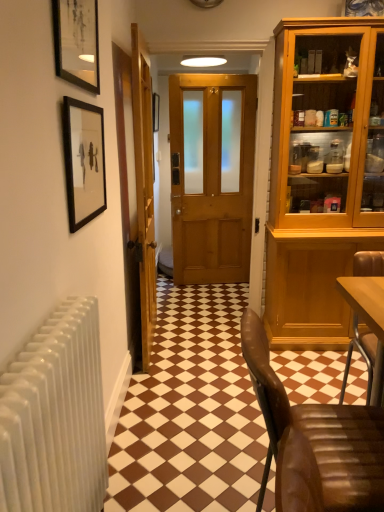
Question: From a real-world perspective, is brown leather chair at lower right physically above wooden door at center, the 1th door from the right?

Choices:
 (A) yes
 (B) no

Answer: (B)

Question: Does brown leather chair at lower right turn towards wooden door at center, positioned as the 2th door in left-to-right order?

Choices:
 (A) no
 (B) yes

Answer: (A)

Question: Is brown leather chair at lower right positioned beyond the bounds of wooden door at center, the 1th door from the right?

Choices:
 (A) no
 (B) yes

Answer: (B)

Question: From the image's perspective, is brown leather chair at lower right beneath wooden door at center, the 1th door from the right?

Choices:
 (A) yes
 (B) no

Answer: (A)

Question: Can you confirm if brown leather chair at lower right is wider than wooden door at center, the 1th door from the right?

Choices:
 (A) yes
 (B) no

Answer: (A)

Question: Is matte black picture frame at upper left, which is the 1th picture frame in front-to-back order, spatially inside wooden door at center, positioned as the 2th door in left-to-right order, or outside of it?

Choices:
 (A) inside
 (B) outside

Answer: (B)

Question: Would you say matte black picture frame at upper left, which is counted as the second picture frame, starting from the bottom, is to the left or to the right of wooden door at center, positioned as the 2th door in left-to-right order, in the picture?

Choices:
 (A) right
 (B) left

Answer: (B)

Question: Considering the positions of point (76, 44) and point (185, 84), is point (76, 44) closer or farther from the camera than point (185, 84)?

Choices:
 (A) closer
 (B) farther

Answer: (A)

Question: Relative to wooden door at center, positioned as the 2th door in left-to-right order, is matte black picture frame at upper left, which is the 1th picture frame in front-to-back order, in front or behind?

Choices:
 (A) behind
 (B) front

Answer: (B)

Question: Does point (319, 500) appear closer or farther from the camera than point (243, 166)?

Choices:
 (A) closer
 (B) farther

Answer: (A)

Question: From the image's perspective, is brown leather chair at lower right positioned above or below wooden door at center, positioned as the 2th door in left-to-right order?

Choices:
 (A) below
 (B) above

Answer: (A)

Question: Considering the positions of brown leather chair at lower right and wooden door at center, the 1th door from the right, in the image, is brown leather chair at lower right wider or thinner than wooden door at center, the 1th door from the right,?

Choices:
 (A) wide
 (B) thin

Answer: (A)

Question: Visually, is brown leather chair at lower right positioned to the left or to the right of wooden door at center, positioned as the 2th door in left-to-right order?

Choices:
 (A) right
 (B) left

Answer: (A)

Question: Does point (76, 5) appear closer or farther from the camera than point (139, 111)?

Choices:
 (A) farther
 (B) closer

Answer: (B)

Question: Would you say matte black picture frame at upper left, arranged as the third picture frame when viewed from the back, is inside or outside wooden door at center, marked as the 2th door in a right-to-left arrangement?

Choices:
 (A) inside
 (B) outside

Answer: (B)